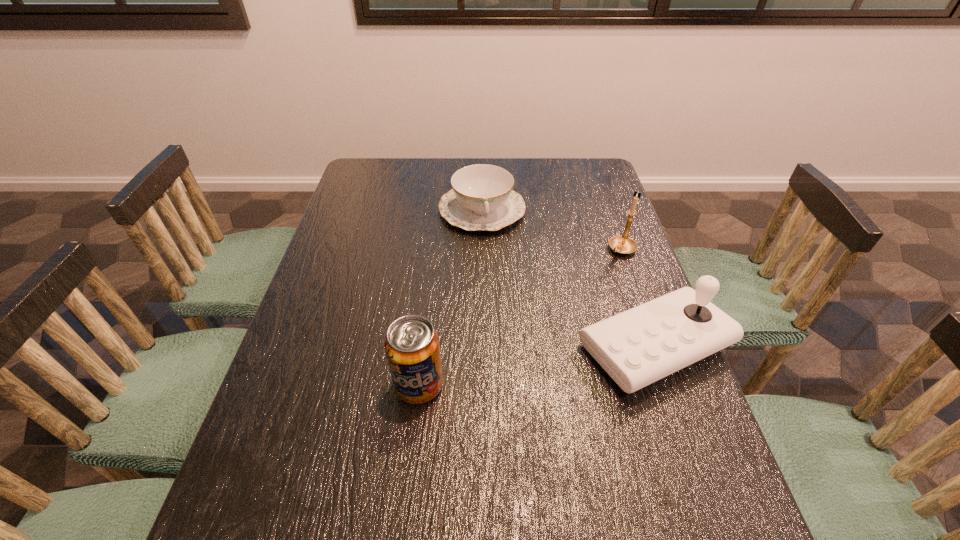
Where is `free region at the far left corner`? free region at the far left corner is located at coordinates (373, 170).

I want to click on vacant region at the far right corner of the desktop, so click(x=590, y=177).

Locate an element on the screen. vacant area that lies between the farthest object and the joystick is located at coordinates (568, 278).

You are a GUI agent. You are given a task and a screenshot of the screen. Output one action in this format:
    pyautogui.click(x=<x>, y=<y>)
    Task: Click on the free space between the chinaware and the second farthest object
    
    Given the screenshot: What is the action you would take?
    pyautogui.click(x=552, y=230)

You are a GUI agent. You are given a task and a screenshot of the screen. Output one action in this format:
    pyautogui.click(x=<x>, y=<y>)
    Task: Click on the unoccupied area between the candle holder and the chinaware
    The height and width of the screenshot is (540, 960).
    Given the screenshot: What is the action you would take?
    pyautogui.click(x=552, y=230)

Locate an element on the screen. Image resolution: width=960 pixels, height=540 pixels. empty space between the soda can and the shortest object is located at coordinates (450, 298).

The image size is (960, 540). Find the location of `free point between the farthest object and the soda can`. free point between the farthest object and the soda can is located at coordinates (450, 298).

Where is `vacant point located between the chinaware and the joystick`? vacant point located between the chinaware and the joystick is located at coordinates (568, 278).

Locate an element on the screen. The image size is (960, 540). vacant point located between the soda can and the joystick is located at coordinates (538, 366).

Locate an element on the screen. unoccupied position between the chinaware and the second farthest object is located at coordinates (552, 230).